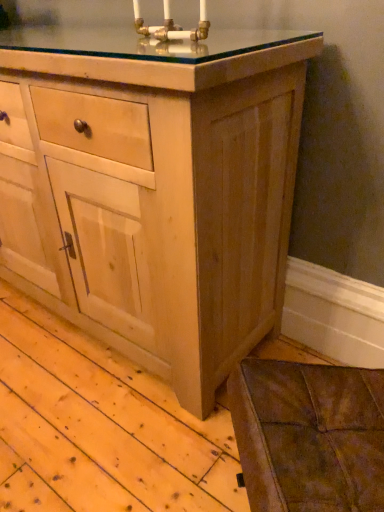
Question: Is natural wood cabinet at center in front of or behind gold brass candle holder at upper center in the image?

Choices:
 (A) behind
 (B) front

Answer: (B)

Question: From the image's perspective, is natural wood cabinet at center located above or below gold brass candle holder at upper center?

Choices:
 (A) above
 (B) below

Answer: (B)

Question: Is point click(x=91, y=139) positioned closer to the camera than point click(x=187, y=31)?

Choices:
 (A) closer
 (B) farther

Answer: (B)

Question: In terms of height, does gold brass candle holder at upper center look taller or shorter compared to natural wood cabinet at center?

Choices:
 (A) short
 (B) tall

Answer: (A)

Question: In the image, is gold brass candle holder at upper center positioned in front of or behind natural wood cabinet at center?

Choices:
 (A) behind
 (B) front

Answer: (A)

Question: Is gold brass candle holder at upper center inside or outside of natural wood cabinet at center?

Choices:
 (A) outside
 (B) inside

Answer: (A)

Question: Looking at their shapes, would you say gold brass candle holder at upper center is wider or thinner than natural wood cabinet at center?

Choices:
 (A) wide
 (B) thin

Answer: (B)